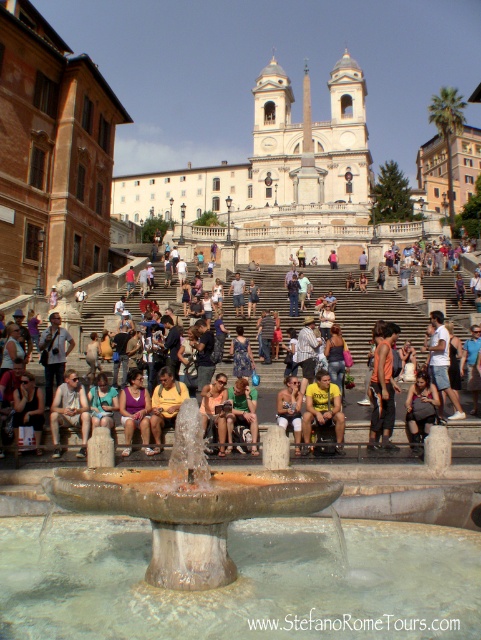
Question: Is orange fabric shirt at center wider than yellow fabric shirt at center?

Choices:
 (A) yes
 (B) no

Answer: (A)

Question: Which object appears farthest from the camera in this image?

Choices:
 (A) orange fabric shirt at center
 (B) stone fountain at center
 (C) yellow fabric shirt at center

Answer: (C)

Question: Is stone fountain at center wider than orange fabric shirt at center?

Choices:
 (A) yes
 (B) no

Answer: (A)

Question: Can you confirm if stone fountain at center is thinner than purple fabric dress at lower center?

Choices:
 (A) yes
 (B) no

Answer: (B)

Question: Which point is closer to the camera?

Choices:
 (A) (141, 428)
 (B) (339, 444)
 (C) (155, 477)
 (D) (379, 353)

Answer: (C)

Question: Among these points, which one is farthest from the camera?

Choices:
 (A) (139, 417)
 (B) (388, 410)
 (C) (138, 512)
 (D) (305, 413)

Answer: (D)